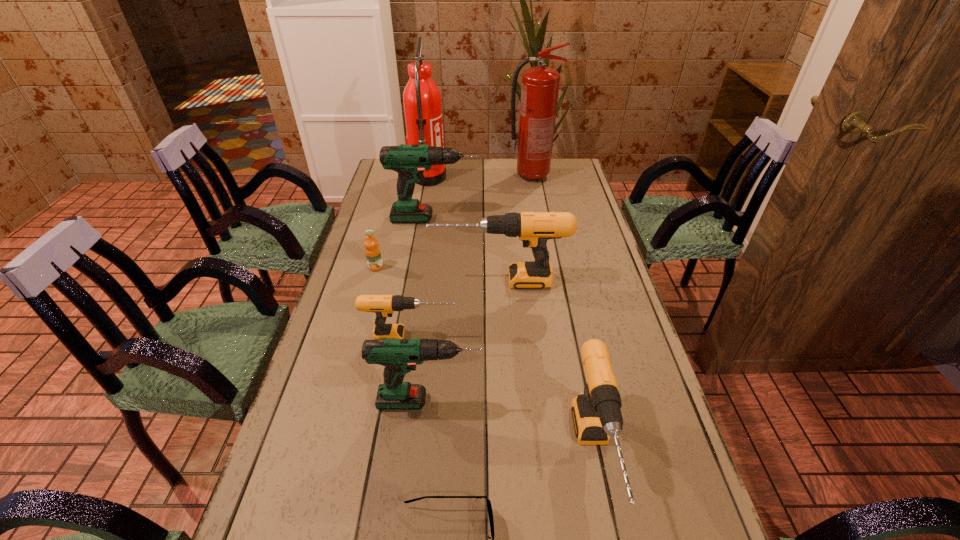
At what (x,y) coordinates should I click in order to perform the action: click on free spot located on the label side of the left fire extinguisher. Please return your answer as a coordinate pair (x, y). The width and height of the screenshot is (960, 540). Looking at the image, I should click on (482, 178).

The width and height of the screenshot is (960, 540). Find the location of `vacant region located on the handle side the right fire extinguisher`. vacant region located on the handle side the right fire extinguisher is located at coordinates (579, 176).

What are the coordinates of `vacant space located on the handle side of the farther green drill` in the screenshot? It's located at (533, 219).

Where is `vacant space located 0.130m on the handle side of the fourth nearest drill`? vacant space located 0.130m on the handle side of the fourth nearest drill is located at coordinates (390, 281).

This screenshot has height=540, width=960. I want to click on vacant point located on the handle side of the fourth nearest drill, so click(x=367, y=281).

Locate an element on the screen. Image resolution: width=960 pixels, height=540 pixels. free space located on the handle side of the fourth nearest drill is located at coordinates (373, 281).

Find the location of a particular element. The height and width of the screenshot is (540, 960). vacant area situated on the handle side of the smaller green drill is located at coordinates (538, 401).

This screenshot has height=540, width=960. In order to click on free region located on the handle side of the third nearest drill in this screenshot , I will do `click(545, 336)`.

The image size is (960, 540). Find the location of `vacant region located 0.290m on the label of the orange juice`. vacant region located 0.290m on the label of the orange juice is located at coordinates (355, 342).

Locate an element on the screen. fire extinguisher at the left edge is located at coordinates (422, 102).